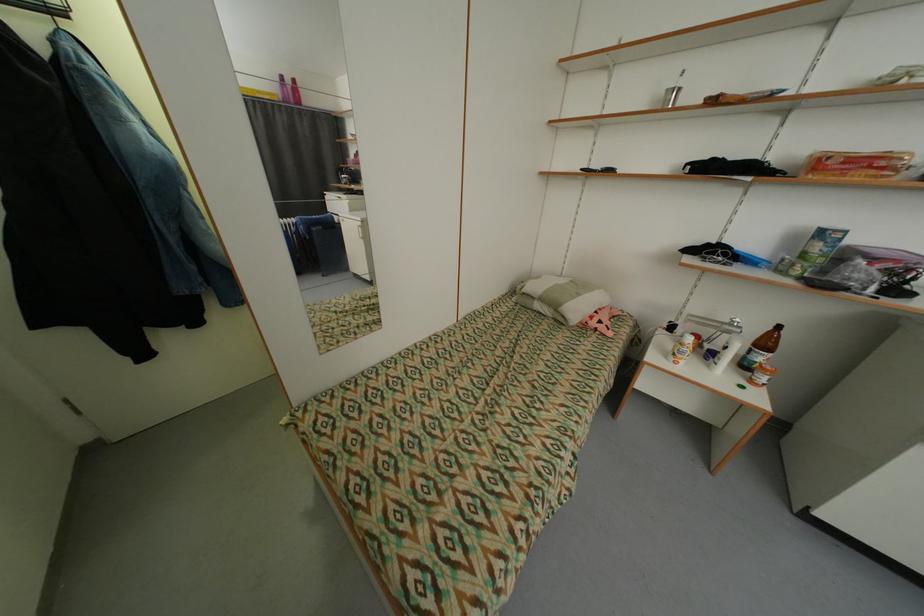
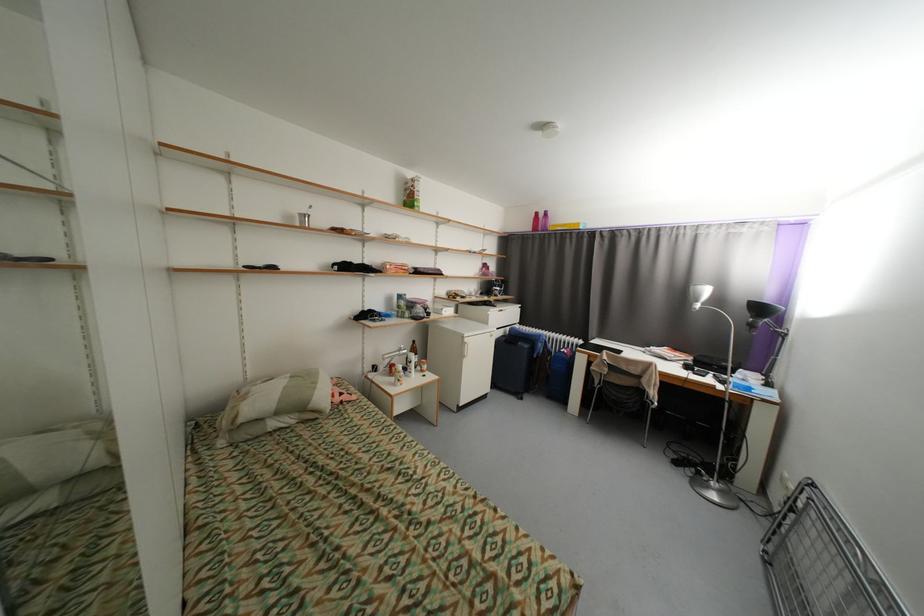
Find the pixel in the second image that matches (665,108) in the first image.

(305, 225)